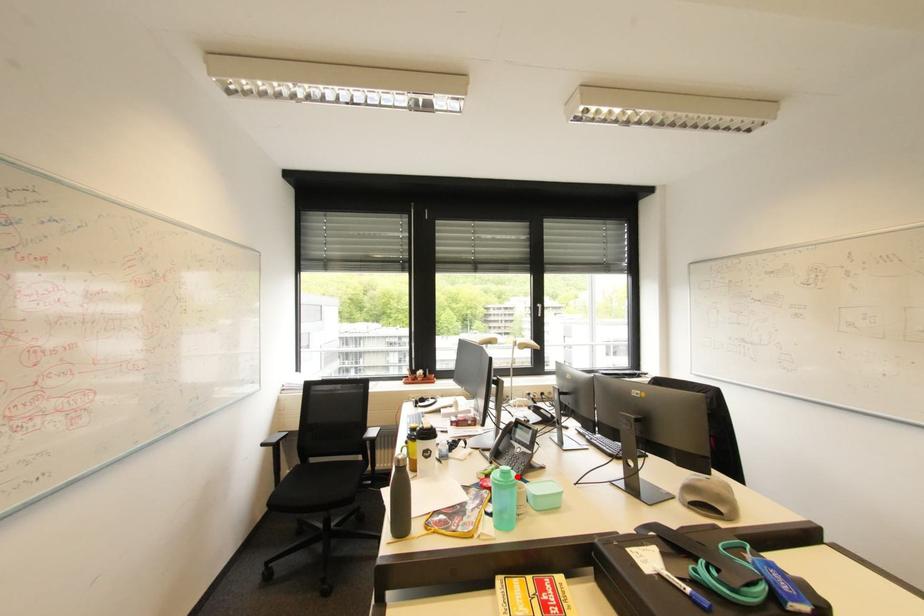
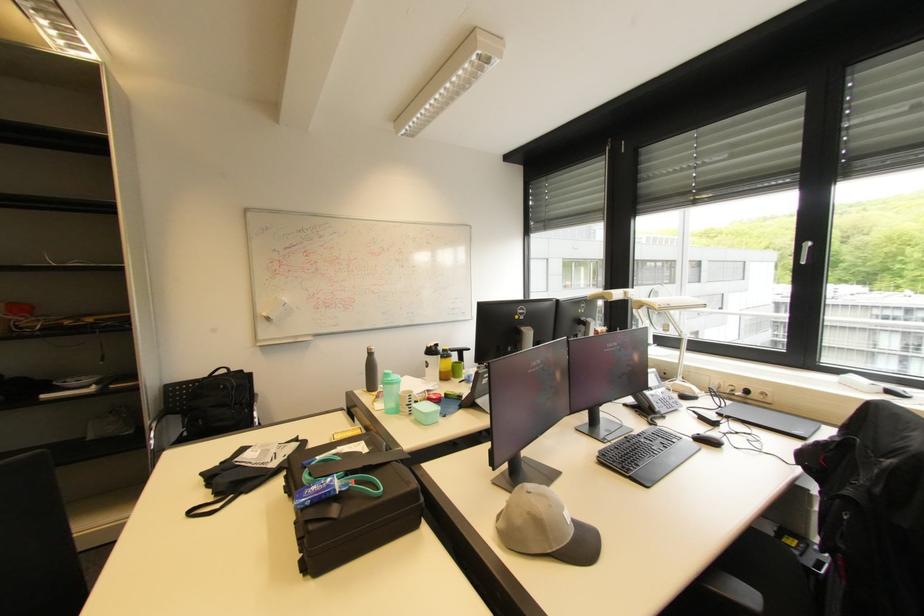
The point at the highlighted location is marked in the first image. Where is the corresponding point in the second image?

(394, 379)